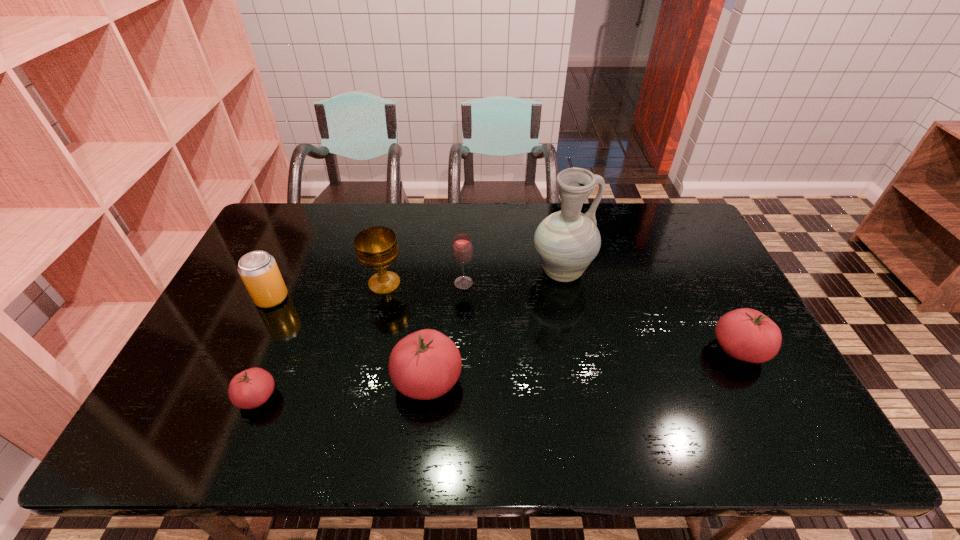
The height and width of the screenshot is (540, 960). Find the location of `vacant area situated on the right of the shortest object`. vacant area situated on the right of the shortest object is located at coordinates (348, 397).

Locate an element on the screen. vacant region located 0.190m on the back of the second tomato from left to right is located at coordinates (436, 299).

Image resolution: width=960 pixels, height=540 pixels. Find the location of `free region located 0.080m on the back of the rightmost tomato`. free region located 0.080m on the back of the rightmost tomato is located at coordinates (716, 306).

Where is `blank space located on the right of the pop (soda)`? This screenshot has width=960, height=540. blank space located on the right of the pop (soda) is located at coordinates (346, 298).

Where is `free region located on the handle side of the pitcher`? This screenshot has height=540, width=960. free region located on the handle side of the pitcher is located at coordinates (705, 273).

The width and height of the screenshot is (960, 540). I want to click on vacant position located on the back of the glass drink container, so click(x=466, y=236).

The height and width of the screenshot is (540, 960). What are the coordinates of `free space located 0.110m on the front of the third object from left to right` in the screenshot? It's located at (375, 326).

Find the location of a particular element. object located in the left edge section of the desktop is located at coordinates (258, 270).

At what (x,y) coordinates should I click in order to perform the action: click on object that is at the right edge. Please return your answer as a coordinate pair (x, y). This screenshot has height=540, width=960. Looking at the image, I should click on (745, 334).

You are a GUI agent. You are given a task and a screenshot of the screen. Output one action in this format:
    pyautogui.click(x=<x>, y=<y>)
    Task: Click on the vacant space at the far edge of the desktop
    Image resolution: width=960 pixels, height=540 pixels.
    Given the screenshot: What is the action you would take?
    pyautogui.click(x=642, y=214)